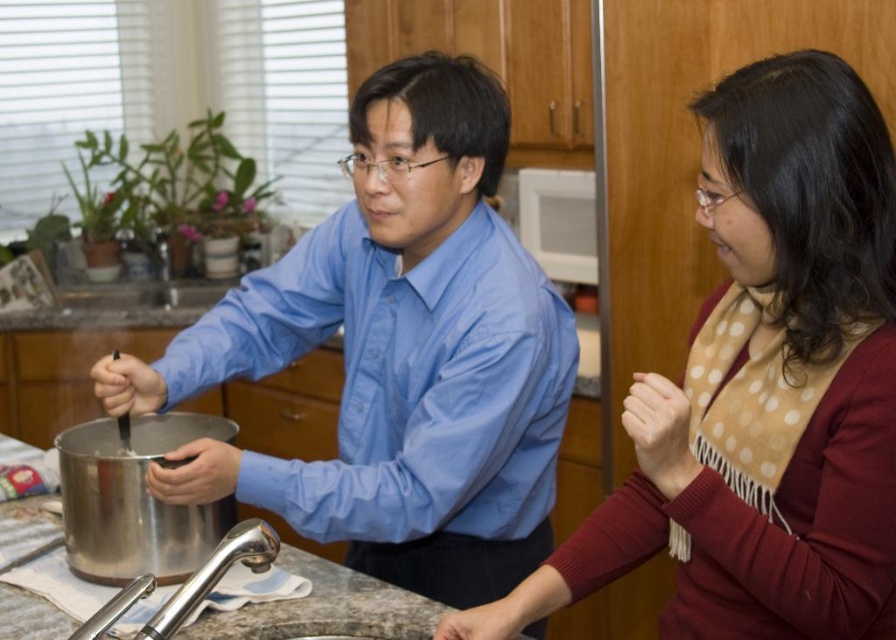
You are a photographer setting up a shoot in this kitchen. You want to ensure that both the matte brown scarf at right and the matte blue shirt at center are clearly visible in the photo. Based on their positions, which object should you focus on first to ensure both are in focus?

The matte brown scarf at right is in front of the matte blue shirt at center. To ensure both are in focus, you should focus on the matte brown scarf at right first since it is closer to the camera, and the background object will still be in focus if focused on the closer one.

You are a fashion designer observing two people in a kitchen. You need to determine which item of clothing is smaller in size between the matte brown scarf at right and the matte blue shirt at center. Which one is smaller?

The matte brown scarf at right has a smaller size compared to the matte blue shirt at center, so the matte brown scarf at right is smaller.

You are standing in the kitchen and want to reach both points. Which point, point [735,365] or point [461,160], would you need to move closer to the camera to reach?

Point [461,160] is further from the camera than point [735,365]. To reach it, you would need to move closer to the camera because it is farther away.